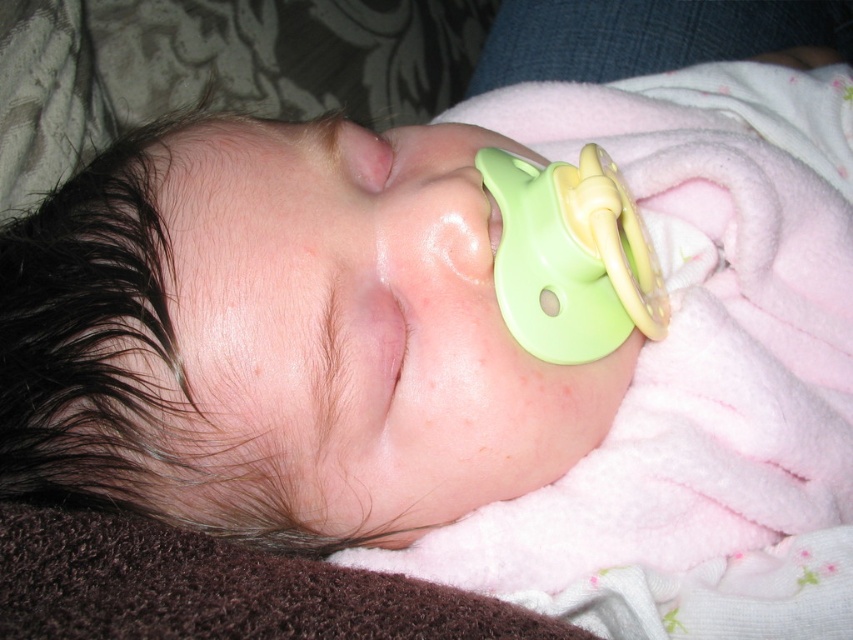
Question: Is pink fleece blanket at center bigger than smooth skin at center?

Choices:
 (A) no
 (B) yes

Answer: (B)

Question: Which object is closer to the camera taking this photo?

Choices:
 (A) green rubber pacifier at center
 (B) pink fleece blanket at center
 (C) smooth skin at center

Answer: (C)

Question: Which object is positioned farthest from the green rubber pacifier at center?

Choices:
 (A) pink fleece blanket at center
 (B) smooth skin at center

Answer: (A)

Question: Which of the following is the farthest from the observer?

Choices:
 (A) pink fleece blanket at center
 (B) smooth skin at center

Answer: (A)

Question: Does green rubber pacifier at center have a larger size compared to smooth skin at center?

Choices:
 (A) no
 (B) yes

Answer: (B)

Question: Can you confirm if pink fleece blanket at center is positioned to the left of green rubber pacifier at center?

Choices:
 (A) yes
 (B) no

Answer: (B)